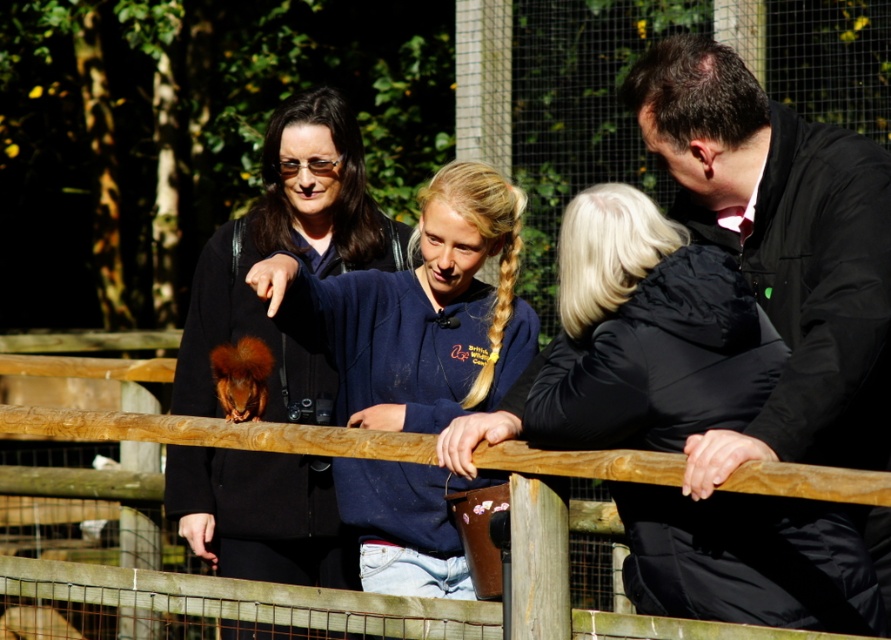
Question: Considering the relative positions of black matte jacket at center and matte black jacket at center in the image provided, where is black matte jacket at center located with respect to matte black jacket at center?

Choices:
 (A) above
 (B) below

Answer: (A)

Question: Which point appears closest to the camera in this image?

Choices:
 (A) (836, 406)
 (B) (215, 400)

Answer: (A)

Question: Which object is positioned farthest from the blue fleece jacket at center?

Choices:
 (A) black matte jacket at upper right
 (B) matte black jacket at center

Answer: (A)

Question: Which point is closer to the camera?

Choices:
 (A) (x=300, y=317)
 (B) (x=674, y=492)
 (C) (x=283, y=196)
 (D) (x=849, y=189)

Answer: (B)

Question: Is black matte jacket at center further to camera compared to black matte jacket at upper right?

Choices:
 (A) no
 (B) yes

Answer: (B)

Question: Is black matte jacket at center below matte black jacket at center?

Choices:
 (A) no
 (B) yes

Answer: (A)